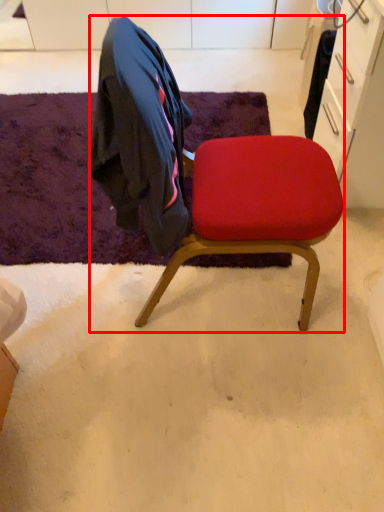
Question: From the image's perspective, considering the relative positions of chair (annotated by the red box) and mat in the image provided, where is chair (annotated by the red box) located with respect to the staircase?

Choices:
 (A) below
 (B) above

Answer: (A)